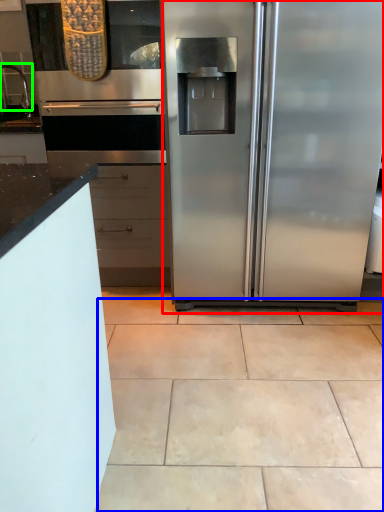
Question: Based on their relative distances, which object is nearer to refrigerator (highlighted by a red box)? Choose from ceramic tile (highlighted by a blue box) and faucet (highlighted by a green box).

Choices:
 (A) ceramic tile
 (B) faucet

Answer: (A)